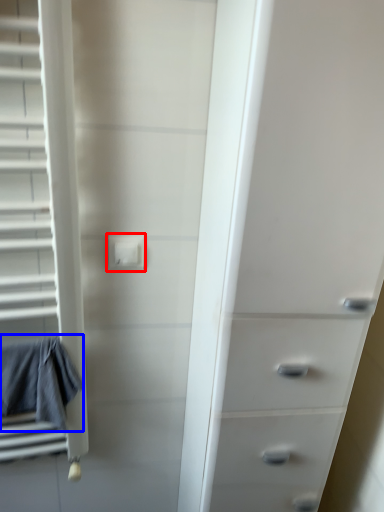
Question: Which point is further to the camera, electric outlet (highlighted by a red box) or bath towel (highlighted by a blue box)?

Choices:
 (A) electric outlet
 (B) bath towel

Answer: (A)